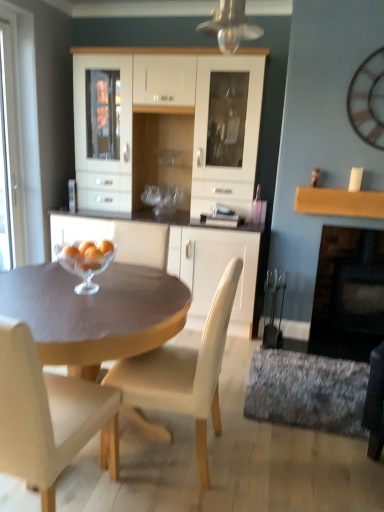
Question: Is matte brown table at center taller than clear glass bowl at center?

Choices:
 (A) yes
 (B) no

Answer: (A)

Question: Does matte brown table at center contain clear glass bowl at center?

Choices:
 (A) no
 (B) yes

Answer: (A)

Question: Considering the relative positions of matte brown table at center and clear glass bowl at center in the image provided, is matte brown table at center behind clear glass bowl at center?

Choices:
 (A) no
 (B) yes

Answer: (A)

Question: Is matte brown table at center bigger than clear glass bowl at center?

Choices:
 (A) yes
 (B) no

Answer: (A)

Question: From the image's perspective, is matte brown table at center located above clear glass bowl at center?

Choices:
 (A) yes
 (B) no

Answer: (B)

Question: Would you say matte brown table at center is outside clear glass bowl at center?

Choices:
 (A) no
 (B) yes

Answer: (B)

Question: Considering the relative positions of beige leather chair at center, the 1th chair positioned from the left, and white leather chair at center, the 2th chair viewed from the left, in the image provided, is beige leather chair at center, the 1th chair positioned from the left, to the left of white leather chair at center, the 2th chair viewed from the left, from the viewer's perspective?

Choices:
 (A) yes
 (B) no

Answer: (A)

Question: Can you confirm if beige leather chair at center, which appears as the 2th chair when viewed from the right, is bigger than white leather chair at center, the 2th chair viewed from the left?

Choices:
 (A) no
 (B) yes

Answer: (A)

Question: Considering the relative sizes of beige leather chair at center, which appears as the 2th chair when viewed from the right, and white leather chair at center, the 2th chair viewed from the left, in the image provided, is beige leather chair at center, which appears as the 2th chair when viewed from the right, wider than white leather chair at center, the 2th chair viewed from the left,?

Choices:
 (A) no
 (B) yes

Answer: (B)

Question: Does beige leather chair at center, which appears as the 2th chair when viewed from the right, have a lesser width compared to white leather chair at center, the 2th chair viewed from the left?

Choices:
 (A) no
 (B) yes

Answer: (A)

Question: Can you confirm if beige leather chair at center, the 1th chair positioned from the left, is positioned to the right of white leather chair at center, the 1th chair when ordered from right to left?

Choices:
 (A) yes
 (B) no

Answer: (B)

Question: Is beige leather chair at center, the 1th chair positioned from the left, positioned behind white leather chair at center, the 1th chair when ordered from right to left?

Choices:
 (A) yes
 (B) no

Answer: (B)

Question: Is wooden clock at upper right not within black matte fireplace at right?

Choices:
 (A) yes
 (B) no

Answer: (A)